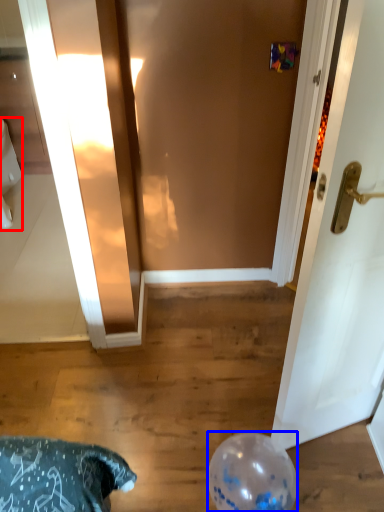
Question: Among these objects, which one is farthest to the camera, toilet bowl (highlighted by a red box) or balloon (highlighted by a blue box)?

Choices:
 (A) toilet bowl
 (B) balloon

Answer: (A)